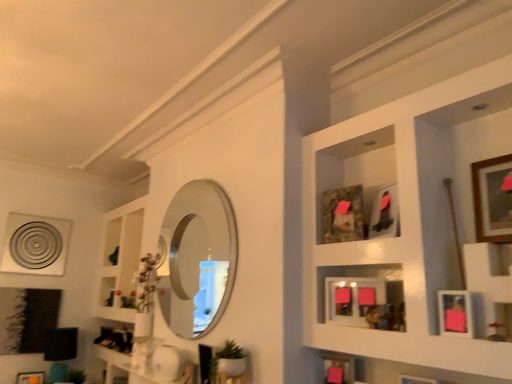
Question: Would you say matte pink picture frame at center, placed as the fifth picture frame when sorted from right to left, contains wooden picture frames at upper right?

Choices:
 (A) yes
 (B) no

Answer: (B)

Question: Is matte pink picture frame at center, acting as the fourth picture frame starting from the bottom, taller than wooden picture frames at upper right?

Choices:
 (A) no
 (B) yes

Answer: (A)

Question: Does matte pink picture frame at center, the fourth picture frame in the left-to-right sequence, have a larger size compared to wooden picture frames at upper right?

Choices:
 (A) yes
 (B) no

Answer: (B)

Question: From the image's perspective, would you say matte pink picture frame at center, placed as the 4th picture frame when sorted from back to front, is positioned over wooden picture frames at upper right?

Choices:
 (A) no
 (B) yes

Answer: (A)

Question: Is matte pink picture frame at center, which ranks as the fifth picture frame in top-to-bottom order, wider than wooden picture frames at upper right?

Choices:
 (A) yes
 (B) no

Answer: (B)

Question: Is matte pink picture frame at center, acting as the fourth picture frame starting from the bottom, positioned before wooden picture frames at upper right?

Choices:
 (A) yes
 (B) no

Answer: (B)

Question: Is matte pink picture frame at center, acting as the fourth picture frame starting from the bottom, a part of matte orange picture frame at lower left, the eighth picture frame positioned from the top?

Choices:
 (A) yes
 (B) no

Answer: (B)

Question: Is matte orange picture frame at lower left, which is the 2th picture frame in left-to-right order, facing away from matte pink picture frame at center, acting as the fourth picture frame starting from the bottom?

Choices:
 (A) no
 (B) yes

Answer: (A)

Question: Is matte orange picture frame at lower left, the seventh picture frame when ordered from right to left, wider than matte pink picture frame at center, acting as the fourth picture frame starting from the bottom?

Choices:
 (A) yes
 (B) no

Answer: (A)

Question: Is matte orange picture frame at lower left, the eighth picture frame positioned from the top, next to matte pink picture frame at center, which ranks as the fifth picture frame in top-to-bottom order?

Choices:
 (A) yes
 (B) no

Answer: (B)

Question: Is matte orange picture frame at lower left, which is the 2th picture frame in left-to-right order, far away from matte pink picture frame at center, which ranks as the fifth picture frame in top-to-bottom order?

Choices:
 (A) yes
 (B) no

Answer: (A)

Question: Would you say matte orange picture frame at lower left, acting as the first picture frame starting from the bottom, is outside matte pink picture frame at center, the fourth picture frame in the left-to-right sequence?

Choices:
 (A) no
 (B) yes

Answer: (B)

Question: Considering the relative sizes of camouflage fabric picture frame at center, the third picture frame when ordered from top to bottom, and pink matte picture frame at lower right, the fourth picture frame in the top-to-bottom sequence, in the image provided, is camouflage fabric picture frame at center, the third picture frame when ordered from top to bottom, bigger than pink matte picture frame at lower right, the fourth picture frame in the top-to-bottom sequence,?

Choices:
 (A) no
 (B) yes

Answer: (B)